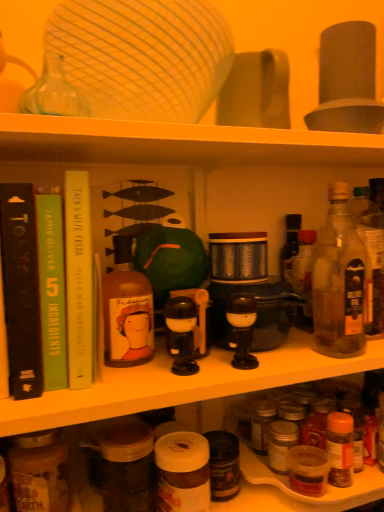
Where is `free space in front of matte glass bottle at center-left, which is the third bottle in right-to-left order`? free space in front of matte glass bottle at center-left, which is the third bottle in right-to-left order is located at coordinates (119, 387).